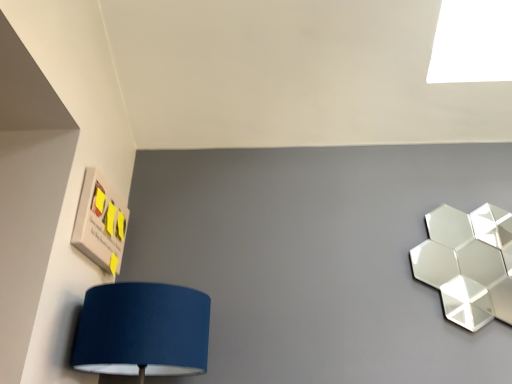
Find the location of a particular element. Image resolution: width=512 pixels, height=384 pixels. matte wood sign with sticky notes at upper left is located at coordinates (100, 223).

Where is `white glossy light at upper right`? white glossy light at upper right is located at coordinates pos(472,42).

Is shiny metallic hexagonal at upper right far from white glossy light at upper right?

shiny metallic hexagonal at upper right is far away from white glossy light at upper right.

How different are the orientations of shiny metallic hexagonal at upper right and white glossy light at upper right in degrees?

The angle between the facing direction of shiny metallic hexagonal at upper right and the facing direction of white glossy light at upper right is 0.783 degrees.

Is shiny metallic hexagonal at upper right positioned before white glossy light at upper right?

Yes, the depth of shiny metallic hexagonal at upper right is less than that of white glossy light at upper right.

Is white glossy light at upper right completely or partially inside shiny metallic hexagonal at upper right?

No.

Is point (481, 40) closer to viewer compared to point (115, 250)?

No, it is behind (115, 250).

Looking at this image, considering the relative positions of white glossy light at upper right and matte wood sign with sticky notes at upper left in the image provided, is white glossy light at upper right to the left or to the right of matte wood sign with sticky notes at upper left?

Based on their positions, white glossy light at upper right is located to the right of matte wood sign with sticky notes at upper left.

Is white glossy light at upper right oriented away from matte wood sign with sticky notes at upper left?

No, white glossy light at upper right's orientation is not away from matte wood sign with sticky notes at upper left.

Consider the image. Considering the relative positions of white glossy light at upper right and matte wood sign with sticky notes at upper left in the image provided, is white glossy light at upper right behind matte wood sign with sticky notes at upper left?

Yes, the depth of white glossy light at upper right is greater than that of matte wood sign with sticky notes at upper left.

Considering the relative sizes of white glossy light at upper right and shiny metallic hexagonal at upper right in the image provided, is white glossy light at upper right shorter than shiny metallic hexagonal at upper right?

Indeed, white glossy light at upper right has a lesser height compared to shiny metallic hexagonal at upper right.

Looking at their sizes, would you say white glossy light at upper right is wider or thinner than shiny metallic hexagonal at upper right?

In the image, white glossy light at upper right appears to be wider than shiny metallic hexagonal at upper right.

From a real-world perspective, who is located lower, white glossy light at upper right or shiny metallic hexagonal at upper right?

shiny metallic hexagonal at upper right, from a real-world perspective.

Is matte wood sign with sticky notes at upper left to the left or to the right of white glossy light at upper right in the image?

Based on their positions, matte wood sign with sticky notes at upper left is located to the left of white glossy light at upper right.

Is matte wood sign with sticky notes at upper left turned away from white glossy light at upper right?

No, white glossy light at upper right is not at the back of matte wood sign with sticky notes at upper left.

From the image's perspective, which object appears higher, matte wood sign with sticky notes at upper left or white glossy light at upper right?

white glossy light at upper right, from the image's perspective.

Which object is more forward, matte wood sign with sticky notes at upper left or white glossy light at upper right?

matte wood sign with sticky notes at upper left is more forward.

Looking at this image, considering the sizes of shiny metallic hexagonal at upper right and matte wood sign with sticky notes at upper left in the image, is shiny metallic hexagonal at upper right taller or shorter than matte wood sign with sticky notes at upper left?

shiny metallic hexagonal at upper right is taller than matte wood sign with sticky notes at upper left.

Is shiny metallic hexagonal at upper right touching matte wood sign with sticky notes at upper left?

There is a gap between shiny metallic hexagonal at upper right and matte wood sign with sticky notes at upper left.

From the image's perspective, is shiny metallic hexagonal at upper right positioned above or below matte wood sign with sticky notes at upper left?

Clearly, from the image's perspective, shiny metallic hexagonal at upper right is below matte wood sign with sticky notes at upper left.

Between shiny metallic hexagonal at upper right and matte wood sign with sticky notes at upper left, which one is positioned in front?

matte wood sign with sticky notes at upper left.

Between point (75, 242) and point (476, 241), which one is positioned in front?

Point (75, 242)

Is matte wood sign with sticky notes at upper left bigger than shiny metallic hexagonal at upper right?

Incorrect, matte wood sign with sticky notes at upper left is not larger than shiny metallic hexagonal at upper right.

Where is `square in front of the shiny metallic hexagonal at upper right`? This screenshot has width=512, height=384. square in front of the shiny metallic hexagonal at upper right is located at coordinates (100, 223).

From a real-world perspective, which is physically below, matte wood sign with sticky notes at upper left or shiny metallic hexagonal at upper right?

shiny metallic hexagonal at upper right, from a real-world perspective.

In order to click on lamp in front of the white glossy light at upper right in this screenshot , I will do `click(468, 263)`.

Locate an element on the screen. square that is on the left side of white glossy light at upper right is located at coordinates (100, 223).

Estimate the real-world distances between objects in this image. Which object is further from shiny metallic hexagonal at upper right, matte wood sign with sticky notes at upper left or white glossy light at upper right?

matte wood sign with sticky notes at upper left.

Which object lies nearer to the anchor point matte wood sign with sticky notes at upper left, shiny metallic hexagonal at upper right or white glossy light at upper right?

Based on the image, white glossy light at upper right appears to be nearer to matte wood sign with sticky notes at upper left.

Considering their positions, is shiny metallic hexagonal at upper right positioned closer to white glossy light at upper right than matte wood sign with sticky notes at upper left?

shiny metallic hexagonal at upper right lies closer to white glossy light at upper right than the other object.

From the image, which object appears to be nearer to matte wood sign with sticky notes at upper left, white glossy light at upper right or shiny metallic hexagonal at upper right?

white glossy light at upper right lies closer to matte wood sign with sticky notes at upper left than the other object.

Looking at the image, which one is located closer to shiny metallic hexagonal at upper right, white glossy light at upper right or matte wood sign with sticky notes at upper left?

Based on the image, white glossy light at upper right appears to be nearer to shiny metallic hexagonal at upper right.

Looking at the image, which one is located further to white glossy light at upper right, matte wood sign with sticky notes at upper left or shiny metallic hexagonal at upper right?

matte wood sign with sticky notes at upper left is further to white glossy light at upper right.

Where is `lamp situated between matte wood sign with sticky notes at upper left and white glossy light at upper right from left to right`? This screenshot has width=512, height=384. lamp situated between matte wood sign with sticky notes at upper left and white glossy light at upper right from left to right is located at coordinates (468, 263).